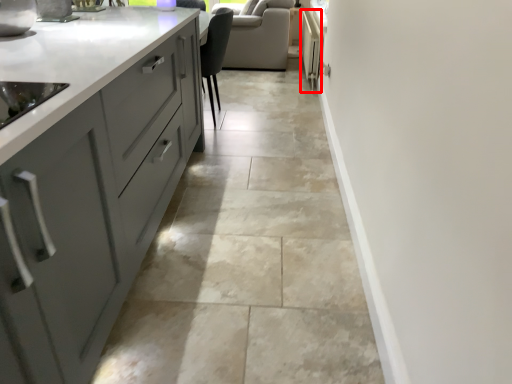
Question: Where is appliance (annotated by the red box) located in relation to granite in the image?

Choices:
 (A) left
 (B) right

Answer: (B)